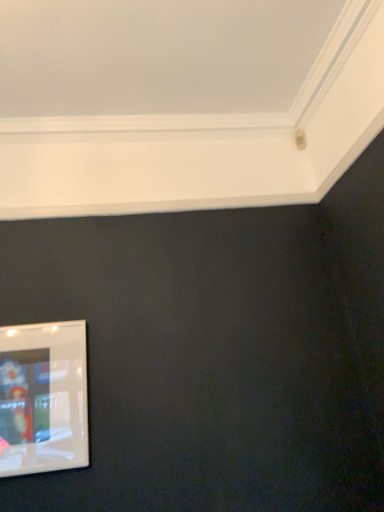
The image size is (384, 512). What are the coordinates of `clear plastic picture frame at lower left` in the screenshot? It's located at (43, 398).

Describe the element at coordinates (43, 398) in the screenshot. I see `clear plastic picture frame at lower left` at that location.

Find the location of `clear plastic picture frame at lower left`. clear plastic picture frame at lower left is located at coordinates 43,398.